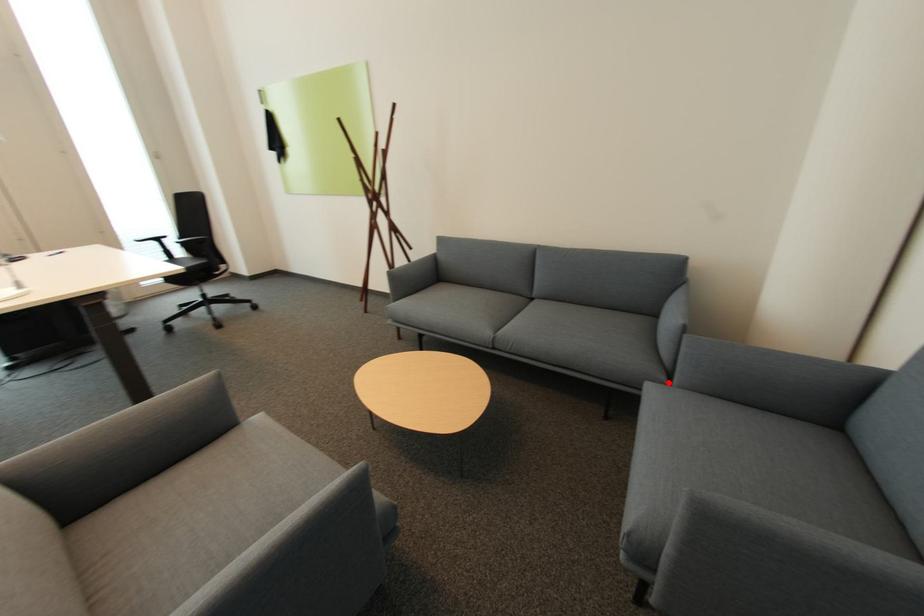
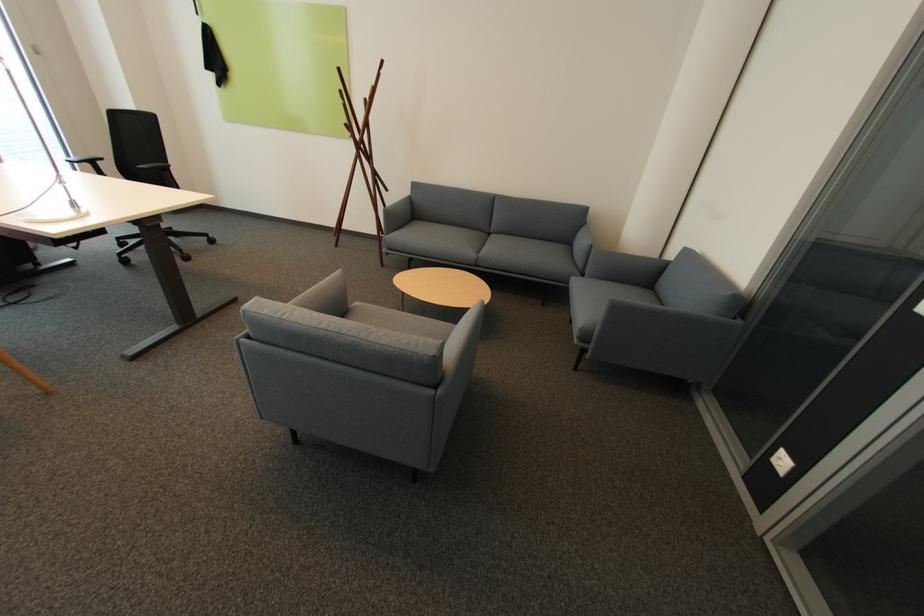
Question: I am providing you with two images of the same scene from different viewpoints. Image1 has a red point marked. In image2, the corresponding 3D location appears at what relative position? Reply with the corresponding letter.

Choices:
 (A) Closer
 (B) Farther

Answer: (A)